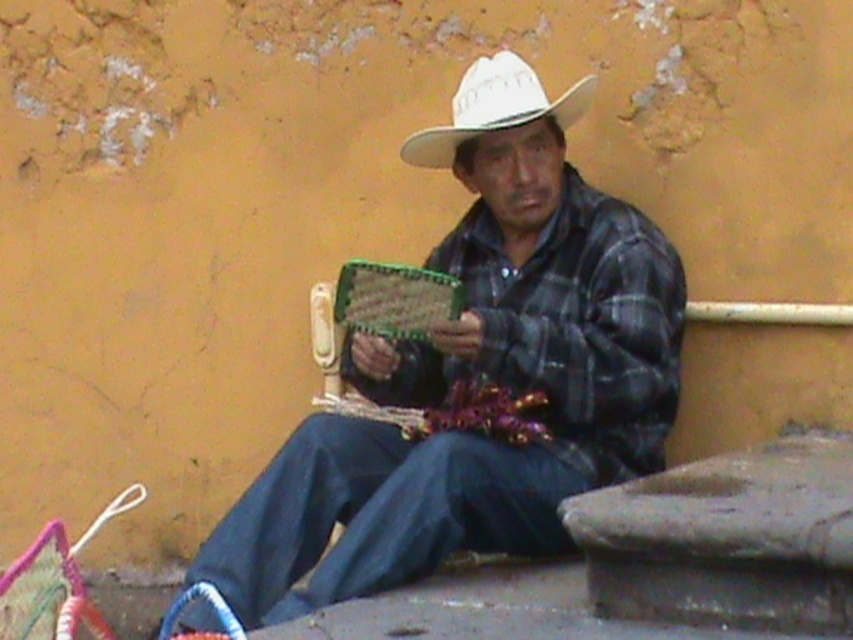
In the scene shown: Can you confirm if plaid fabric shirt at center is wider than white matte cowboy hat at center?

Indeed, plaid fabric shirt at center has a greater width compared to white matte cowboy hat at center.

Is plaid fabric shirt at center behind white matte cowboy hat at center?

No, plaid fabric shirt at center is closer to the viewer.

Does point (560, 154) come closer to viewer compared to point (471, 88)?

No, it is not.

I want to click on plaid fabric shirt at center, so click(x=476, y=372).